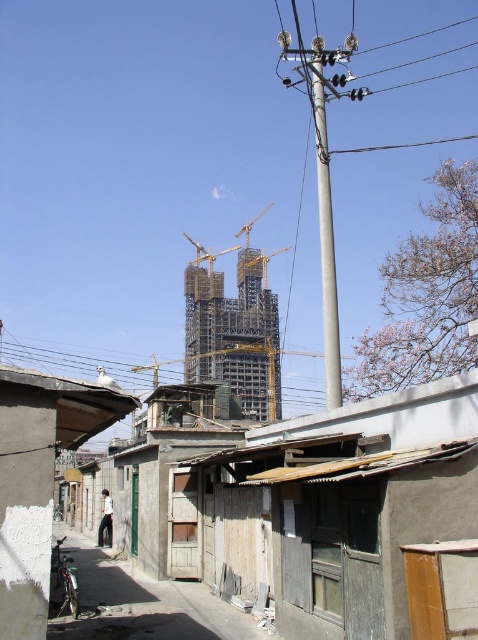
You are a delivery person who needs to park your metallic bicycle at lower left near the gray metallic pole at center. Considering their heights, will the bicycle be visible from above the pole?

The metallic bicycle at lower left is shorter than the gray metallic pole at center, so it will not be visible from above the pole.

You are a construction worker needing to transport materials through the narrow alleyway between the metallic scaffolding tower at center and the gray metallic pole at center. Considering their widths, which object will you have to maneuver around more carefully?

The metallic scaffolding tower at center has a greater width than the gray metallic pole at center, so you will need to maneuver around it more carefully when transporting materials through the narrow alleyway.